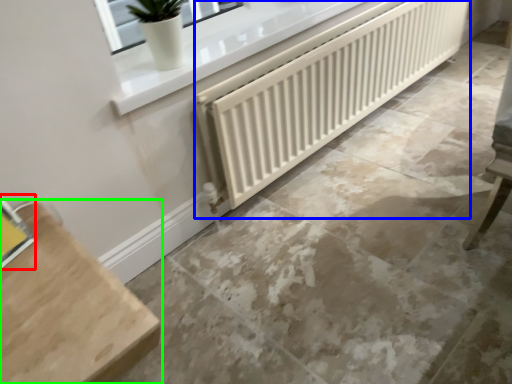
Question: Estimate the real-world distances between objects in this image. Which object is farther from window (highlighted by a red box), radiator (highlighted by a blue box) or furniture (highlighted by a green box)?

Choices:
 (A) radiator
 (B) furniture

Answer: (A)